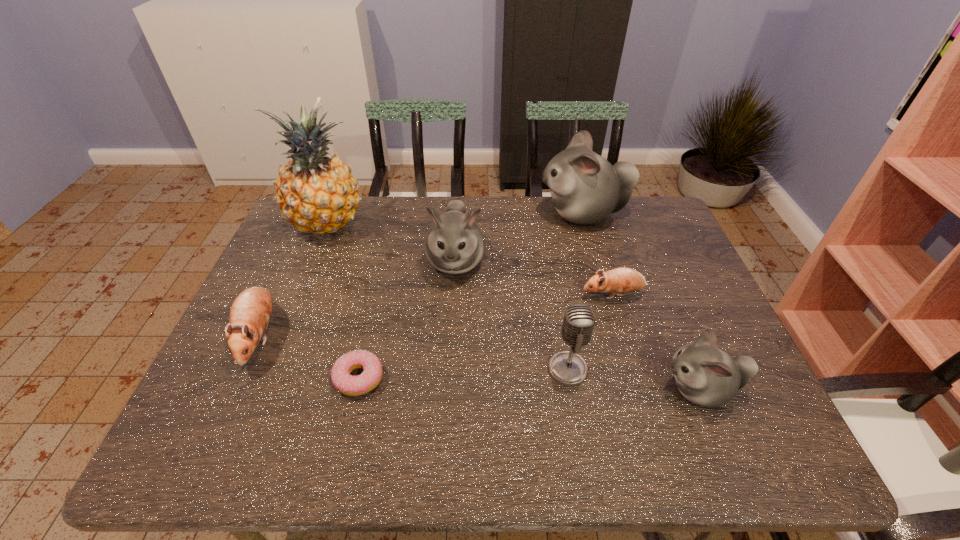
What are the coordinates of `the left brown hamster` in the screenshot? It's located at (250, 313).

Find the location of a particular element. Image resolution: width=960 pixels, height=540 pixels. the smaller brown hamster is located at coordinates [x=622, y=280].

Where is `the right brown hamster`? This screenshot has height=540, width=960. the right brown hamster is located at coordinates (622, 280).

Image resolution: width=960 pixels, height=540 pixels. Find the location of `pink doughnut`. pink doughnut is located at coordinates (349, 385).

The height and width of the screenshot is (540, 960). What are the coordinates of `the third object from left to right` in the screenshot? It's located at (349, 385).

Locate an element on the screen. Image resolution: width=960 pixels, height=540 pixels. blank space located 0.240m on the right of the tallest object is located at coordinates (440, 223).

In order to click on vacant space positioned on the face of the farthest white hamster in this screenshot , I will do `click(500, 214)`.

Where is `free spot located on the face of the farthest white hamster`? free spot located on the face of the farthest white hamster is located at coordinates (479, 214).

Where is `vacant area situated 0.120m on the face of the farthest white hamster`? vacant area situated 0.120m on the face of the farthest white hamster is located at coordinates (503, 214).

The width and height of the screenshot is (960, 540). In order to click on vacant space positioned 0.100m on the face of the second hamster from left to right in this screenshot , I will do `click(452, 318)`.